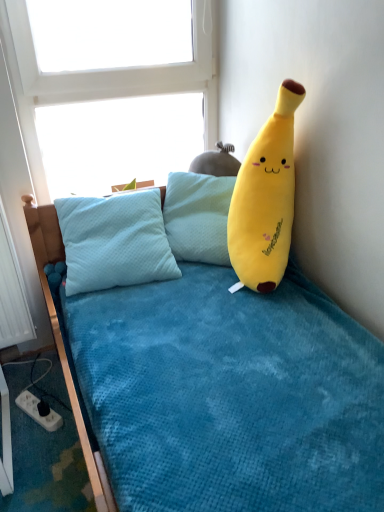
Question: Should I look upward or downward to see soft yellow plush banana at upper right?

Choices:
 (A) down
 (B) up

Answer: (B)

Question: Is soft yellow plush banana at upper right next to transparent glass window at upper center?

Choices:
 (A) yes
 (B) no

Answer: (B)

Question: Considering the relative positions of soft yellow plush banana at upper right and transparent glass window at upper center in the image provided, is soft yellow plush banana at upper right to the left of transparent glass window at upper center from the viewer's perspective?

Choices:
 (A) yes
 (B) no

Answer: (B)

Question: Considering the relative sizes of soft yellow plush banana at upper right and transparent glass window at upper center in the image provided, is soft yellow plush banana at upper right bigger than transparent glass window at upper center?

Choices:
 (A) yes
 (B) no

Answer: (A)

Question: From a real-world perspective, is soft yellow plush banana at upper right physically above transparent glass window at upper center?

Choices:
 (A) yes
 (B) no

Answer: (B)

Question: Is soft yellow plush banana at upper right not inside transparent glass window at upper center?

Choices:
 (A) no
 (B) yes

Answer: (B)

Question: Is soft yellow plush banana at upper right positioned before transparent glass window at upper center?

Choices:
 (A) no
 (B) yes

Answer: (B)

Question: Is soft yellow plush banana at upper right a part of white plastic power outlet at lower left?

Choices:
 (A) no
 (B) yes

Answer: (A)

Question: Is white plastic power outlet at lower left directly adjacent to soft yellow plush banana at upper right?

Choices:
 (A) yes
 (B) no

Answer: (B)

Question: Is white plastic power outlet at lower left wider than soft yellow plush banana at upper right?

Choices:
 (A) yes
 (B) no

Answer: (B)

Question: From a real-world perspective, is white plastic power outlet at lower left on top of soft yellow plush banana at upper right?

Choices:
 (A) no
 (B) yes

Answer: (A)

Question: Considering the relative sizes of white plastic power outlet at lower left and soft yellow plush banana at upper right in the image provided, is white plastic power outlet at lower left taller than soft yellow plush banana at upper right?

Choices:
 (A) yes
 (B) no

Answer: (B)

Question: Considering the relative sizes of white plastic power outlet at lower left and soft yellow plush banana at upper right in the image provided, is white plastic power outlet at lower left bigger than soft yellow plush banana at upper right?

Choices:
 (A) yes
 (B) no

Answer: (B)

Question: Is soft yellow plush banana at upper right closer to camera compared to white plastic power outlet at lower left?

Choices:
 (A) no
 (B) yes

Answer: (B)